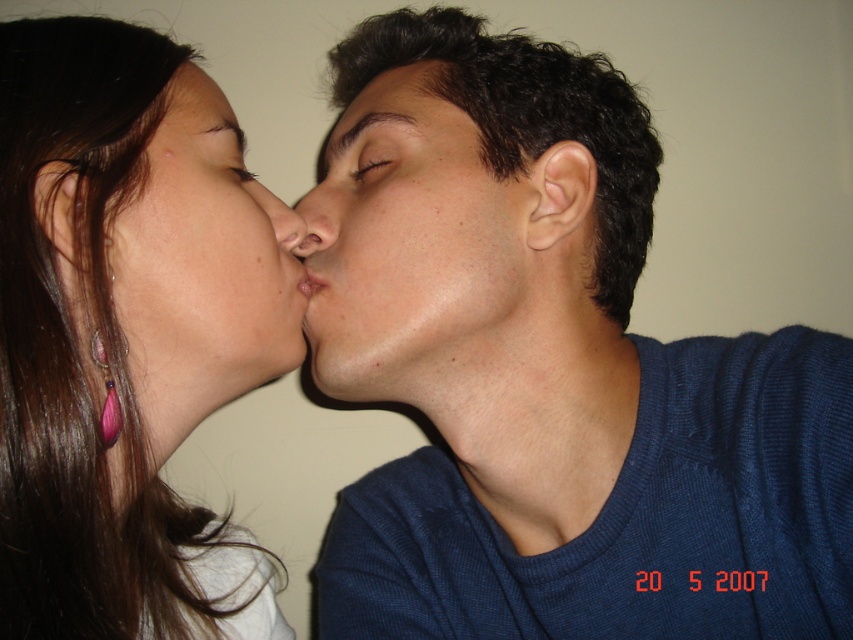
Can you confirm if matte blue sweater at right is positioned to the left of matte skin face at center?

No, matte blue sweater at right is not to the left of matte skin face at center.

Is point (579, 192) closer to viewer compared to point (193, 381)?

No.

Locate an element on the screen. The width and height of the screenshot is (853, 640). matte blue sweater at right is located at coordinates (552, 371).

Who is positioned more to the left, smooth skin face at center or matte skin nose at center?

matte skin nose at center

Between smooth skin face at center and matte skin nose at center, which one is positioned lower?

smooth skin face at center is lower down.

Is point (370, 285) in front of point (270, 192)?

Yes, point (370, 285) is in front of point (270, 192).

In order to click on smooth skin face at center in this screenshot , I will do `click(422, 257)`.

Does point (563, 634) come closer to viewer compared to point (171, 388)?

No, (563, 634) is further to viewer.

Can you confirm if matte blue sweater at right is positioned above smooth skin face at upper left?

Correct, matte blue sweater at right is located above smooth skin face at upper left.

Does point (497, 547) lie behind point (15, 410)?

Yes.

Where is `matte blue sweater at right`? The image size is (853, 640). matte blue sweater at right is located at coordinates (552, 371).